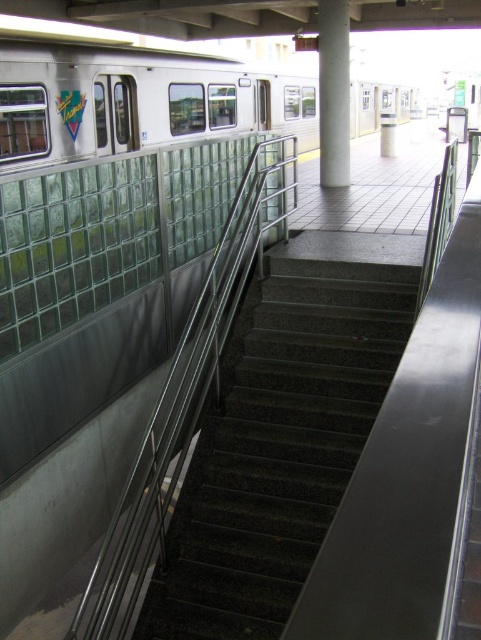
Between granite stairs at center and white glossy pillar at upper center, which one is positioned lower?

granite stairs at center is lower down.

Who is positioned more to the left, granite stairs at center or white glossy pillar at upper center?

Positioned to the left is granite stairs at center.

Does point (226, 621) lie behind point (339, 145)?

No, it is in front of (339, 145).

Locate an element on the screen. The width and height of the screenshot is (481, 640). granite stairs at center is located at coordinates (278, 445).

Does silver metallic train at upper left have a smaller size compared to white glossy pillar at upper center?

No.

Which is behind, point (279, 81) or point (332, 64)?

Positioned behind is point (279, 81).

Does point (139, 104) lie behind point (346, 163)?

No, (139, 104) is in front of (346, 163).

Where is `silver metallic train at upper left`? Image resolution: width=481 pixels, height=640 pixels. silver metallic train at upper left is located at coordinates (137, 97).

Based on the photo, is granite stairs at center thinner than silver metallic train at upper left?

Yes.

The width and height of the screenshot is (481, 640). Describe the element at coordinates (278, 445) in the screenshot. I see `granite stairs at center` at that location.

Is point (185, 625) more distant than point (218, 120)?

No, it is in front of (218, 120).

The height and width of the screenshot is (640, 481). In order to click on granite stairs at center in this screenshot , I will do `click(278, 445)`.